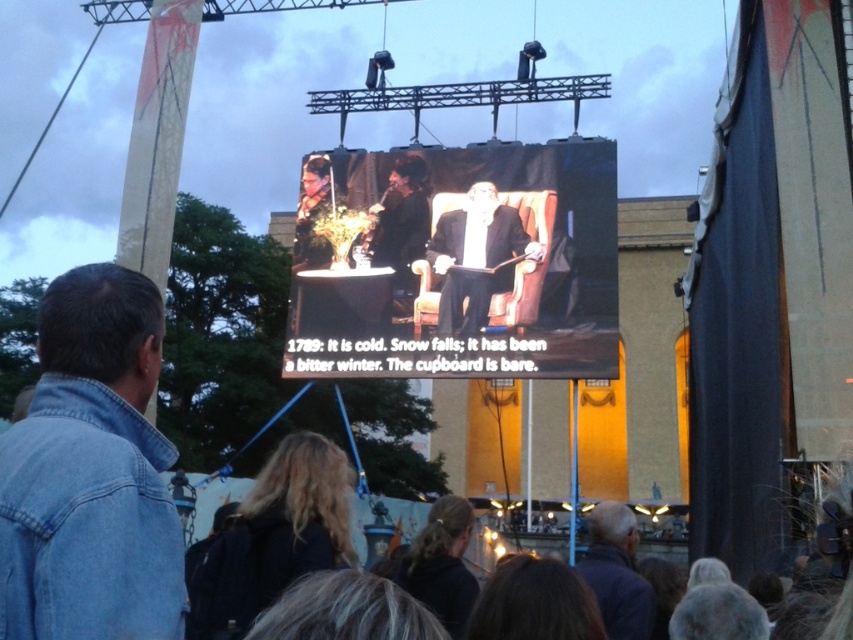
You are an attendee at this outdoor event and want to sit down. You see the matte black chair at center and the denim jacket at lower left. Which object is positioned to the right side from your perspective?

The matte black chair at center is to the right of the denim jacket at lower left, so the matte black chair at center is positioned to the right side from your perspective.

You are standing in front of the large screen at the outdoor event. You want to sit down to watch the performance. Where should you go to find the matte black chair at center?

The matte black chair at center is located at the center of the scene, so you should go to the center area in front of the large screen to find it.

You are a photographer at the event and need to position a camera stand that is 1.2 meters wide between the matte black chair at center and the denim jacket at lower left. Can the camera stand fit between them?

The matte black chair at center might be wider than denim jacket at lower left, so the camera stand may not fit between them if the space is narrower than 1.2 meters. Check the actual width before placing the stand.